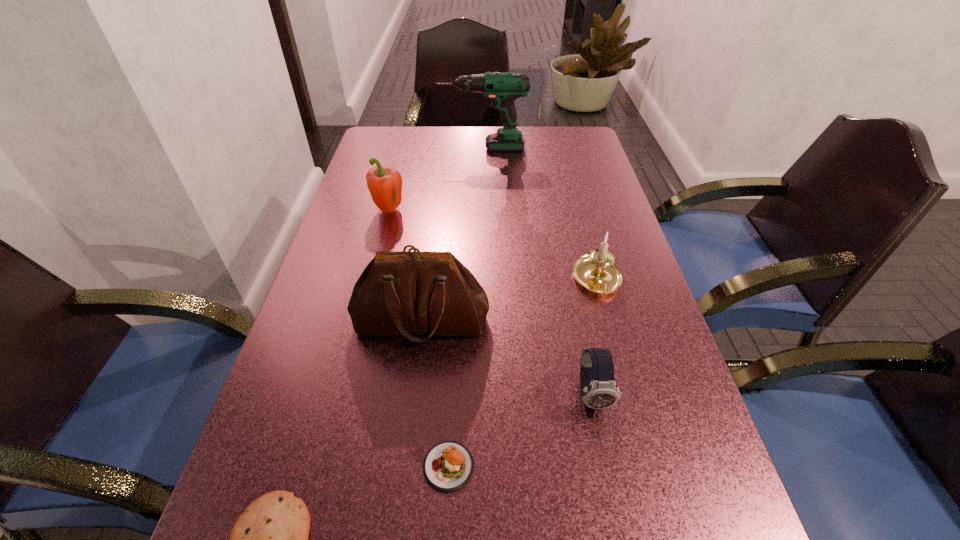
Find the location of a particular element. watch that is at the right edge is located at coordinates (598, 389).

Where is `free spot at the far edge of the desktop`? The image size is (960, 540). free spot at the far edge of the desktop is located at coordinates (516, 127).

In the image, there is a desktop. At what (x,y) coordinates should I click in order to perform the action: click on blank space at the left edge. Please return your answer as a coordinate pair (x, y). Image resolution: width=960 pixels, height=540 pixels. Looking at the image, I should click on click(x=358, y=338).

At what (x,y) coordinates should I click in order to perform the action: click on blank area at the right edge. Please return your answer as a coordinate pair (x, y). The image size is (960, 540). Looking at the image, I should click on (711, 499).

Identify the location of vacant space at the far left corner. (374, 154).

Identify the location of blank region between the third shortest object and the second tallest object. (506, 357).

You are a GUI agent. You are given a task and a screenshot of the screen. Output one action in this format:
    pyautogui.click(x=<x>, y=<y>)
    Task: Click on the vacant area that lies between the pepper and the drill
    
    Given the screenshot: What is the action you would take?
    pyautogui.click(x=436, y=180)

Locate an element on the screen. Image resolution: width=960 pixels, height=540 pixels. free space between the shortest object and the fourth shortest object is located at coordinates (523, 373).

At what (x,y) coordinates should I click in order to perform the action: click on vacant space in between the candle holder and the patty (food). Please return your answer as a coordinate pair (x, y). Looking at the image, I should click on (523, 373).

Find the location of a particular element. This screenshot has height=540, width=960. free space that is in between the second tallest object and the tallest object is located at coordinates (452, 234).